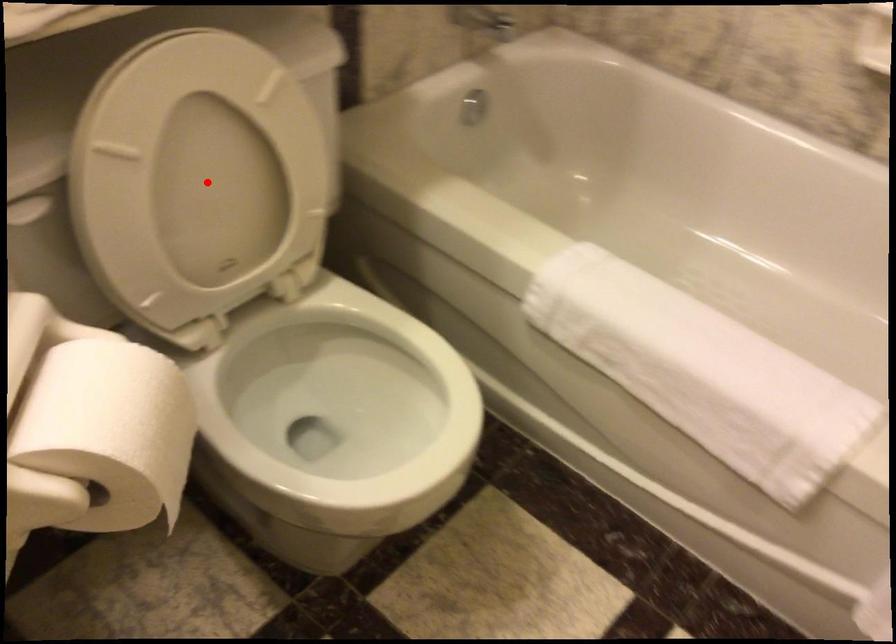
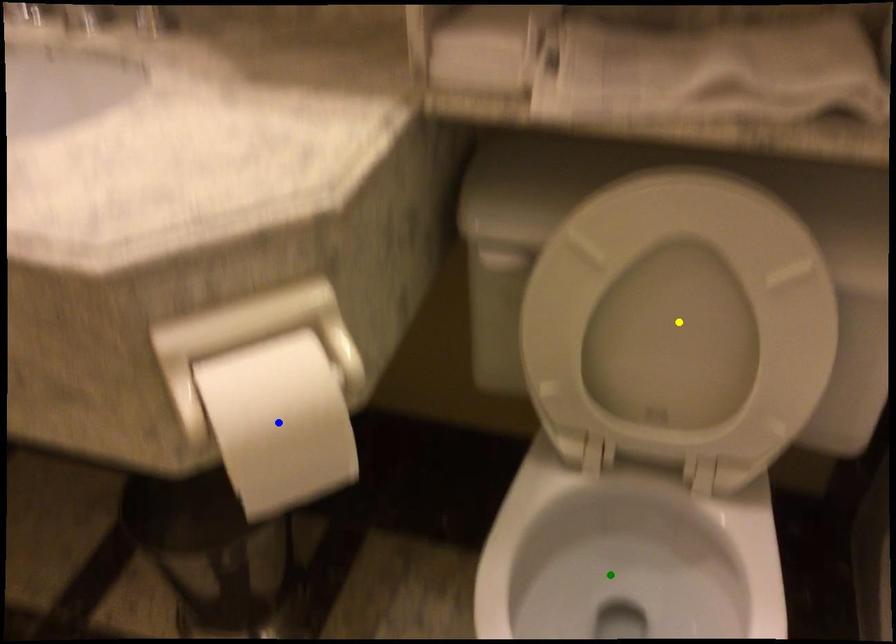
Question: I am providing you with two images of the same scene from different viewpoints. A red point is marked on the first image. You are given multiple points on the second image. Which mark in image 2 goes with the point in image 1?

Choices:
 (A) yellow point
 (B) blue point
 (C) green point

Answer: (A)